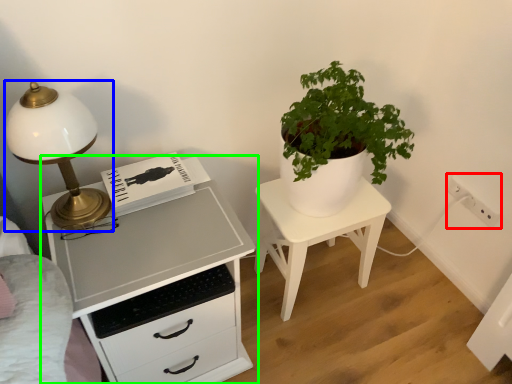
Question: Which is farther away from electric outlet (highlighted by a red box)? lamp (highlighted by a blue box) or chest of drawers (highlighted by a green box)?

Choices:
 (A) lamp
 (B) chest of drawers

Answer: (A)